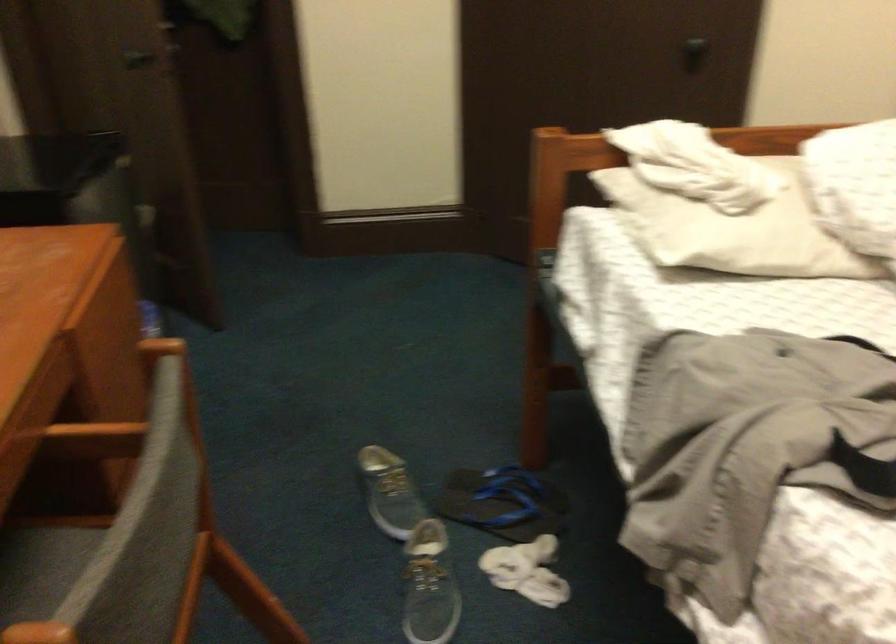
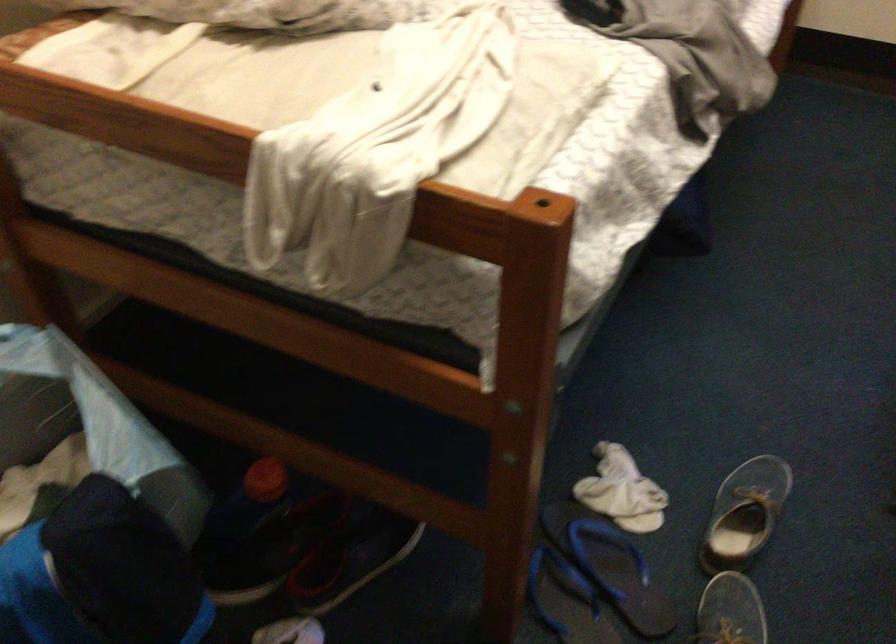
In the second image, find the point that corresponds to [500,496] in the first image.

(566, 600)